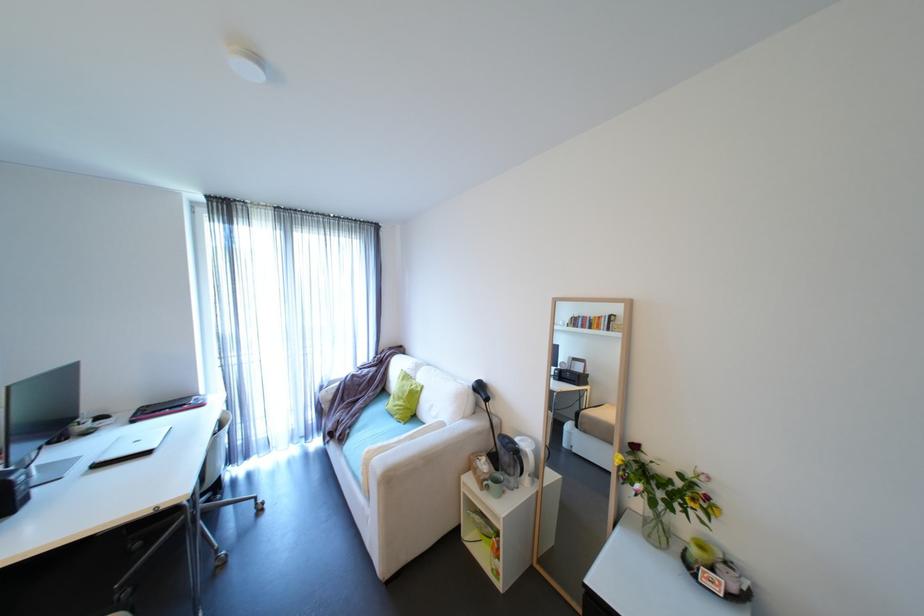
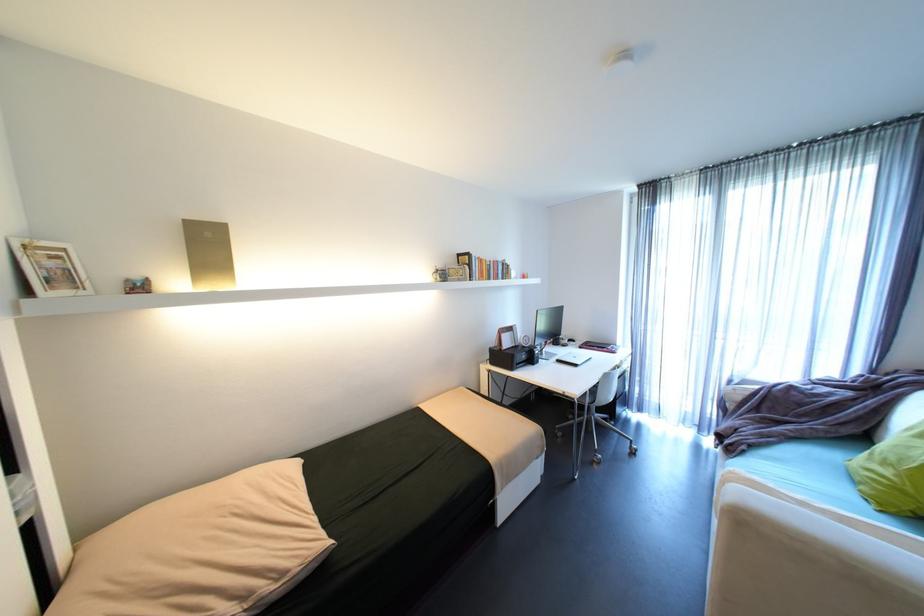
The point at (356, 434) is marked in the first image. Where is the corresponding point in the second image?

(751, 451)